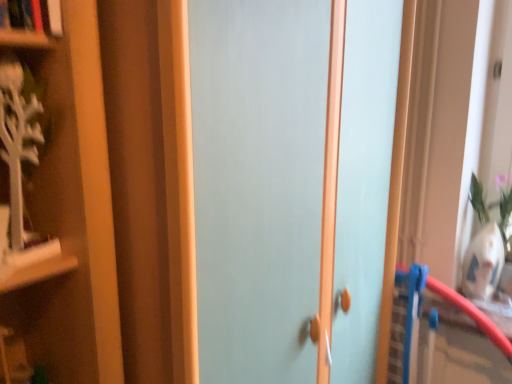
Question: Looking at the image, does matte light blue door at center seem bigger or smaller compared to hardcover book at upper left?

Choices:
 (A) big
 (B) small

Answer: (A)

Question: Considering the positions of point (358, 147) and point (15, 3), is point (358, 147) closer or farther from the camera than point (15, 3)?

Choices:
 (A) closer
 (B) farther

Answer: (B)

Question: Considering their positions, is matte light blue door at center located in front of or behind hardcover book at upper left?

Choices:
 (A) front
 (B) behind

Answer: (A)

Question: From the image's perspective, is hardcover book at upper left positioned above or below matte light blue door at center?

Choices:
 (A) below
 (B) above

Answer: (B)

Question: From a real-world perspective, is hardcover book at upper left positioned above or below matte light blue door at center?

Choices:
 (A) above
 (B) below

Answer: (A)

Question: Considering their positions, is hardcover book at upper left located in front of or behind matte light blue door at center?

Choices:
 (A) behind
 (B) front

Answer: (A)

Question: Looking at the image, does hardcover book at upper left seem bigger or smaller compared to matte light blue door at center?

Choices:
 (A) small
 (B) big

Answer: (A)